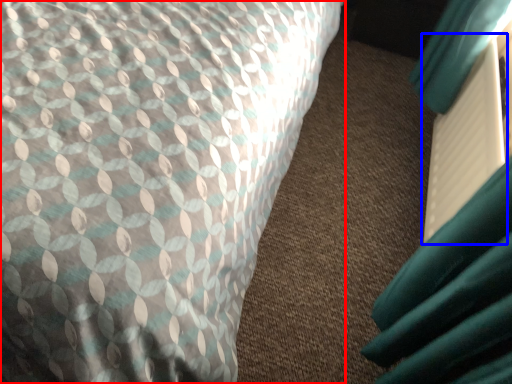
Question: Which point is further to the camera, bed (highlighted by a red box) or paperback book (highlighted by a blue box)?

Choices:
 (A) bed
 (B) paperback book

Answer: (B)